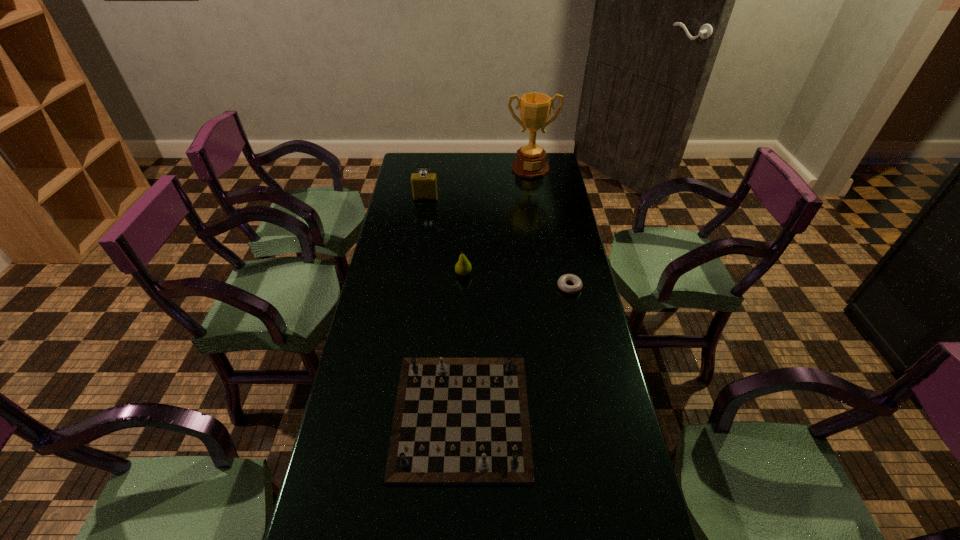
Where is `the tallest object`? the tallest object is located at coordinates (535, 108).

Where is `the farthest object`? Image resolution: width=960 pixels, height=540 pixels. the farthest object is located at coordinates (535, 108).

The height and width of the screenshot is (540, 960). Find the location of `perfume`. perfume is located at coordinates (424, 186).

This screenshot has width=960, height=540. What are the coordinates of `the second tallest object` in the screenshot? It's located at (424, 186).

Where is `pear`? This screenshot has width=960, height=540. pear is located at coordinates (463, 267).

You are a GUI agent. You are given a task and a screenshot of the screen. Output one action in this format:
    pyautogui.click(x=<x>, y=<y>)
    Task: Click on the nearest object
    This screenshot has width=960, height=540.
    Given the screenshot: What is the action you would take?
    coord(458,421)

This screenshot has height=540, width=960. I want to click on chessboard, so click(x=458, y=421).

Locate an element on the screen. the shortest object is located at coordinates (574, 279).

This screenshot has height=540, width=960. What are the coordinates of `vacant region located 0.390m on the front-facing side of the award` in the screenshot? It's located at (540, 231).

I want to click on free space located on the front-facing side of the second tallest object, so click(421, 226).